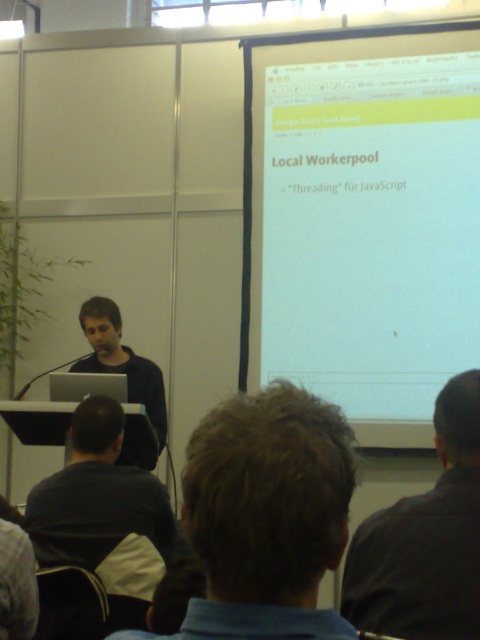
Question: Which object is closer to the camera taking this photo?

Choices:
 (A) brown hair at center
 (B) matte black laptop at center
 (C) dark gray shirt at upper right

Answer: (A)

Question: Which of these objects is positioned closest to the white matte projector screen at upper center?

Choices:
 (A) matte black laptop at center
 (B) dark gray shirt at upper right
 (C) brown hair at center
 (D) dark gray shirt at lower left

Answer: (A)

Question: Does dark gray shirt at upper right appear on the left side of matte black laptop at center?

Choices:
 (A) yes
 (B) no

Answer: (B)

Question: Does brown hair at center have a greater width compared to dark gray shirt at upper right?

Choices:
 (A) yes
 (B) no

Answer: (B)

Question: Estimate the real-world distances between objects in this image. Which object is closer to the white matte projector screen at upper center?

Choices:
 (A) matte black laptop at center
 (B) dark gray shirt at lower left
 (C) dark gray shirt at upper right

Answer: (A)

Question: Is white matte projector screen at upper center above matte black laptop at center?

Choices:
 (A) no
 (B) yes

Answer: (B)